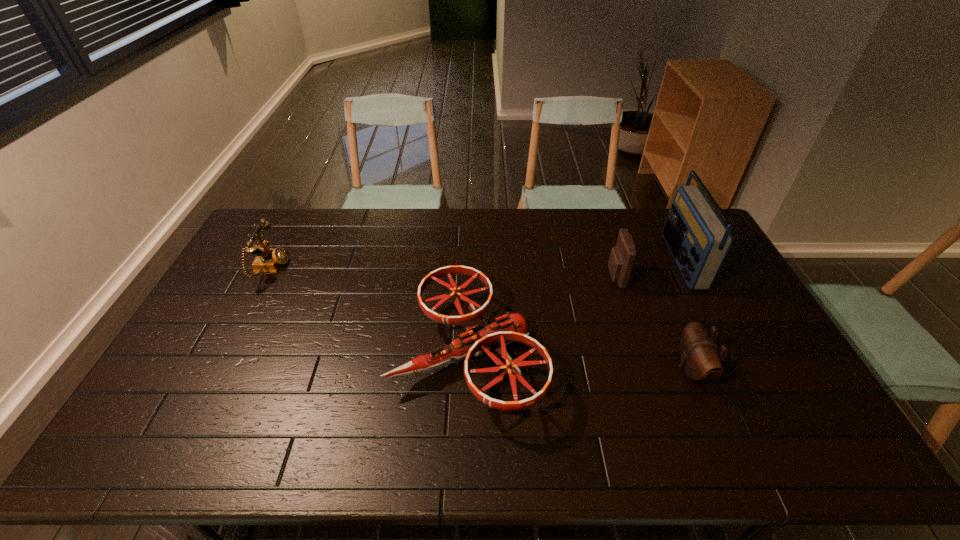
I want to click on the tallest object, so click(699, 241).

Where is `radio receiver`? radio receiver is located at coordinates (699, 241).

The height and width of the screenshot is (540, 960). Identify the location of the third object from right to left. (622, 257).

The image size is (960, 540). Identify the location of the left pouch. (622, 257).

Identify the location of telephone. (268, 260).

Locate an element on the screen. This screenshot has height=540, width=960. the right pouch is located at coordinates (699, 358).

At what (x,y) coordinates should I click in order to perform the action: click on the nearer pouch. Please return your answer as a coordinate pair (x, y). Looking at the image, I should click on (699, 358).

This screenshot has width=960, height=540. I want to click on the fourth object from right to left, so click(480, 336).

In order to click on free spot located on the front panel of the radio receiver in this screenshot , I will do tap(610, 261).

Image resolution: width=960 pixels, height=540 pixels. In order to click on vacant space positioned on the front panel of the radio receiver in this screenshot , I will do click(x=595, y=261).